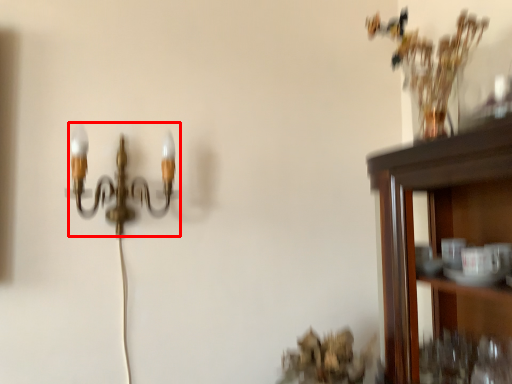
Question: Observing the image, what is the correct spatial positioning of lamp (annotated by the red box) in reference to vase?

Choices:
 (A) right
 (B) left

Answer: (B)